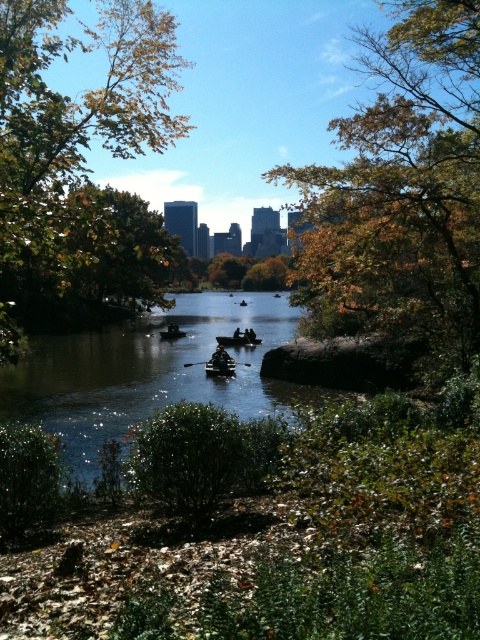
Is green leafy tree at center thinner than wooden rowboat at center?

Incorrect, green leafy tree at center's width is not less than wooden rowboat at center's.

Who is positioned more to the right, green leafy tree at center or wooden rowboat at center?

From the viewer's perspective, green leafy tree at center appears more on the right side.

Is point (259, 276) positioned behind point (213, 368)?

Yes, it is.

Locate an element on the screen. green leafy tree at center is located at coordinates (242, 272).

Is dark blue fabric boat at center taller than black plastic paddle at center?

Yes.

Identify the location of dark blue fabric boat at center. (222, 358).

Is brown leafy tree at upper right thinner than clear water at center?

No.

Who is higher up, brown leafy tree at upper right or clear water at center?

brown leafy tree at upper right is above.

Is point (476, 312) farther from camera compared to point (107, 385)?

That is False.

The height and width of the screenshot is (640, 480). I want to click on brown leafy tree at upper right, so click(x=402, y=193).